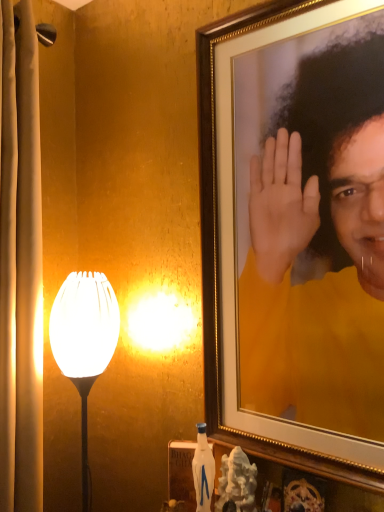
Question: From the image's perspective, relative to matte yellow shirt at upper right, is white glossy lampshade at left above or below?

Choices:
 (A) above
 (B) below

Answer: (B)

Question: From a real-world perspective, is white glossy lampshade at left positioned above or below matte yellow shirt at upper right?

Choices:
 (A) below
 (B) above

Answer: (A)

Question: Is white glossy lampshade at left inside or outside of matte yellow shirt at upper right?

Choices:
 (A) outside
 (B) inside

Answer: (A)

Question: Considering the positions of matte yellow shirt at upper right and white glossy lampshade at left in the image, is matte yellow shirt at upper right taller or shorter than white glossy lampshade at left?

Choices:
 (A) short
 (B) tall

Answer: (B)

Question: From a real-world perspective, is matte yellow shirt at upper right physically located above or below white glossy lampshade at left?

Choices:
 (A) above
 (B) below

Answer: (A)

Question: In terms of width, does matte yellow shirt at upper right look wider or thinner when compared to white glossy lampshade at left?

Choices:
 (A) wide
 (B) thin

Answer: (B)

Question: Is point (261, 318) positioned closer to the camera than point (52, 346)?

Choices:
 (A) farther
 (B) closer

Answer: (B)